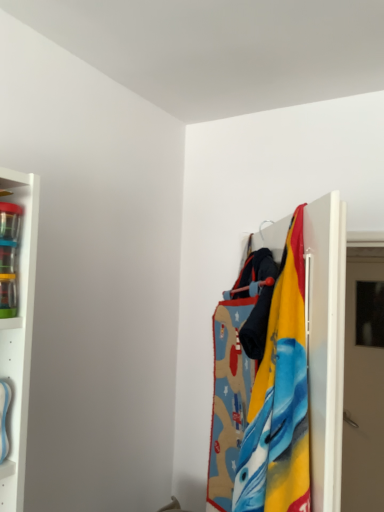
Question: Is point (347, 418) closer or farther from the camera than point (314, 332)?

Choices:
 (A) farther
 (B) closer

Answer: (A)

Question: From a real-world perspective, is beige matte door at right positioned above or below textured fabric at right?

Choices:
 (A) above
 (B) below

Answer: (B)

Question: Considering the positions of beige matte door at right and textured fabric at right in the image, is beige matte door at right taller or shorter than textured fabric at right?

Choices:
 (A) short
 (B) tall

Answer: (B)

Question: Relative to beige matte door at right, is textured fabric at right in front or behind?

Choices:
 (A) behind
 (B) front

Answer: (B)

Question: Is textured fabric at right bigger or smaller than beige matte door at right?

Choices:
 (A) small
 (B) big

Answer: (B)

Question: In terms of width, does textured fabric at right look wider or thinner when compared to beige matte door at right?

Choices:
 (A) wide
 (B) thin

Answer: (A)

Question: Is point (327, 257) closer or farther from the camera than point (367, 301)?

Choices:
 (A) closer
 (B) farther

Answer: (A)